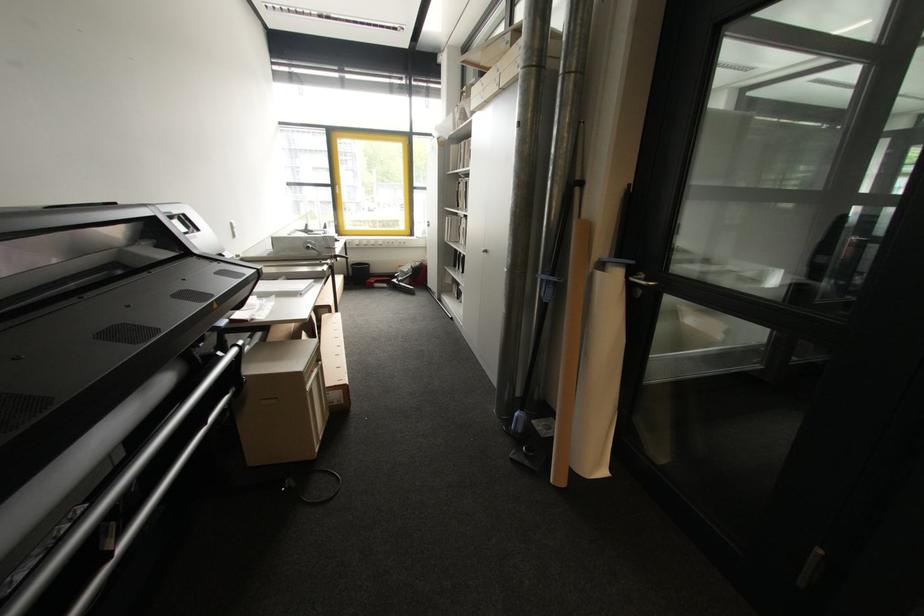
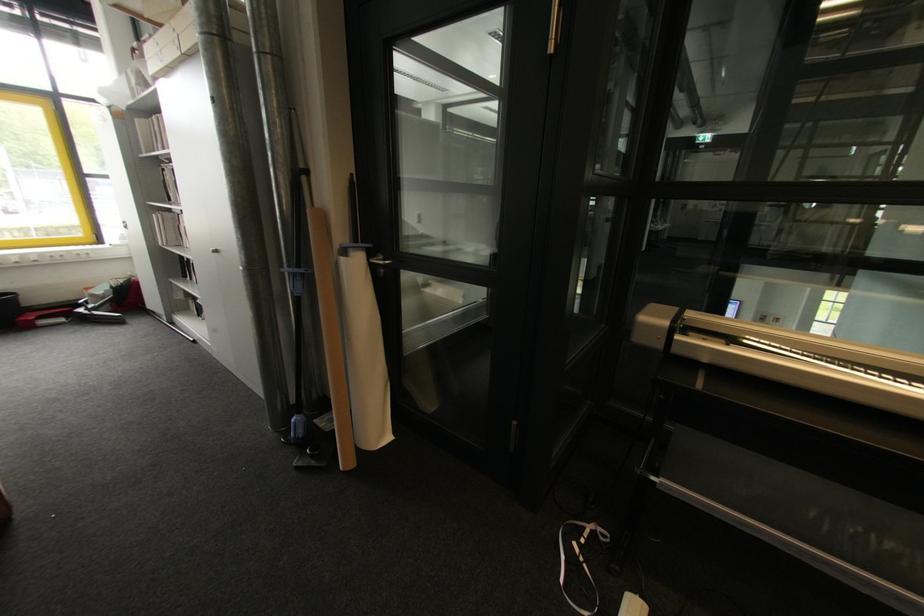
Locate, in the second image, the point that corresponds to (x=371, y=270) in the first image.

(19, 301)